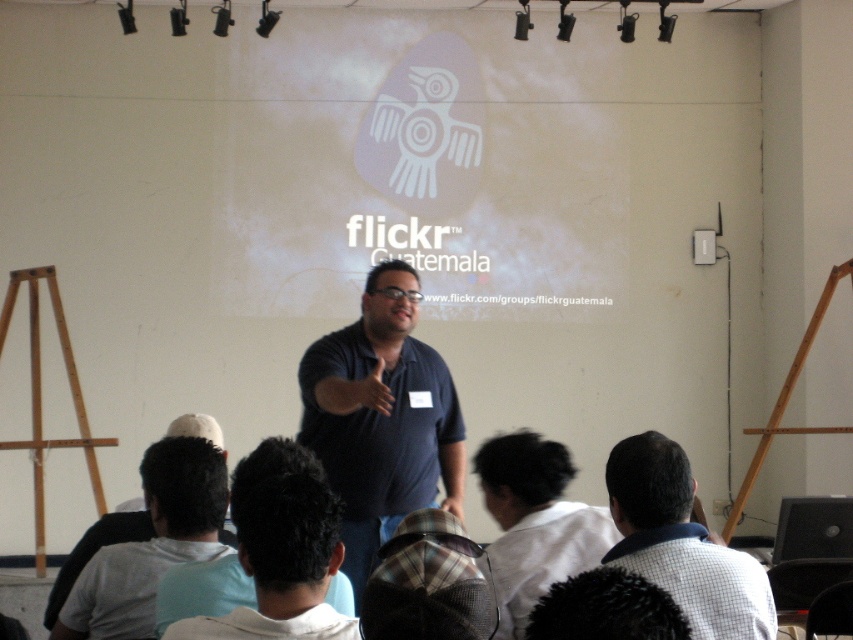
Between white checkered shirt at lower right and dark hair at center, which one is positioned higher?

dark hair at center

Measure the distance between white checkered shirt at lower right and dark hair at center.

A distance of 36.17 inches exists between white checkered shirt at lower right and dark hair at center.

Where is `white checkered shirt at lower right`? Image resolution: width=853 pixels, height=640 pixels. white checkered shirt at lower right is located at coordinates (682, 541).

Where is `white checkered shirt at lower right`? white checkered shirt at lower right is located at coordinates (682, 541).

Is gray fabric shirt at lower left in front of white cotton shirt at lower center?

That is False.

Between point (161, 444) and point (518, 556), which one is positioned behind?

Positioned behind is point (161, 444).

Locate an element on the screen. This screenshot has width=853, height=640. gray fabric shirt at lower left is located at coordinates (151, 541).

Can you confirm if white checkered shirt at lower right is positioned to the right of gray fabric shirt at lower left?

Correct, you'll find white checkered shirt at lower right to the right of gray fabric shirt at lower left.

Identify the location of white checkered shirt at lower right. (682, 541).

Locate an element on the screen. white checkered shirt at lower right is located at coordinates (682, 541).